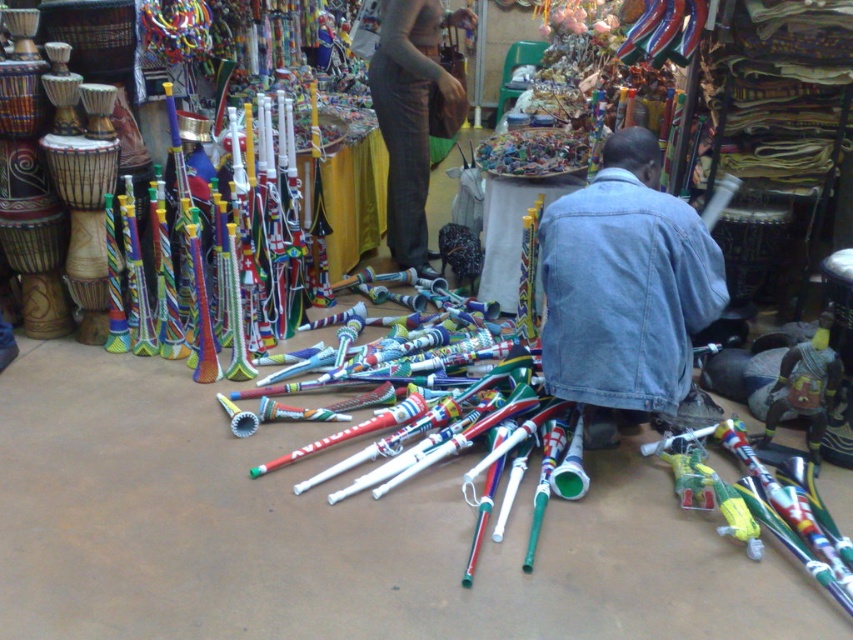
Which is in front, point (656, 324) or point (393, 104)?

Point (656, 324) is more forward.

Can you confirm if denim jacket at lower right is positioned below dark gray pants at center?

Yes.

Between point (612, 342) and point (416, 113), which one is positioned behind?

The point (416, 113) is behind.

This screenshot has width=853, height=640. I want to click on denim jacket at lower right, so click(x=624, y=291).